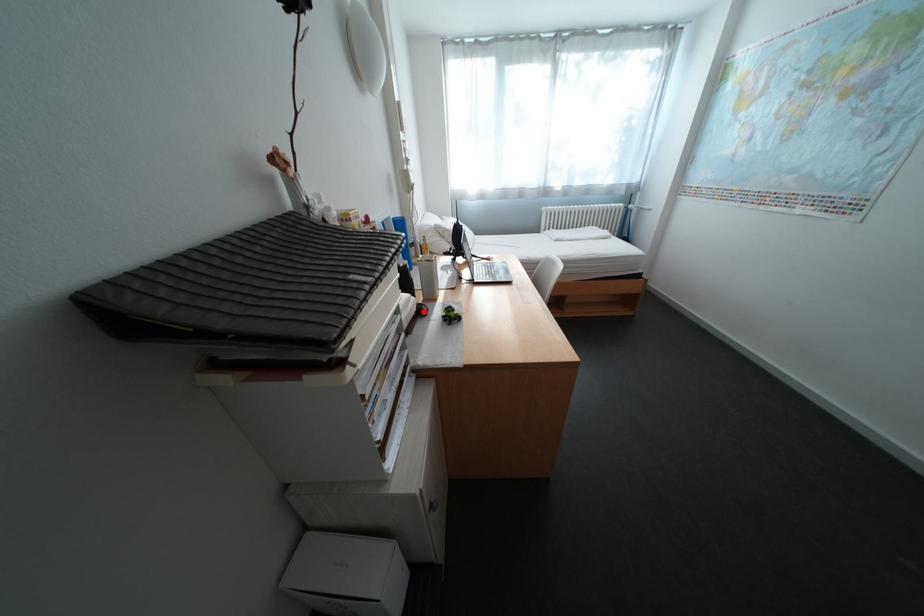
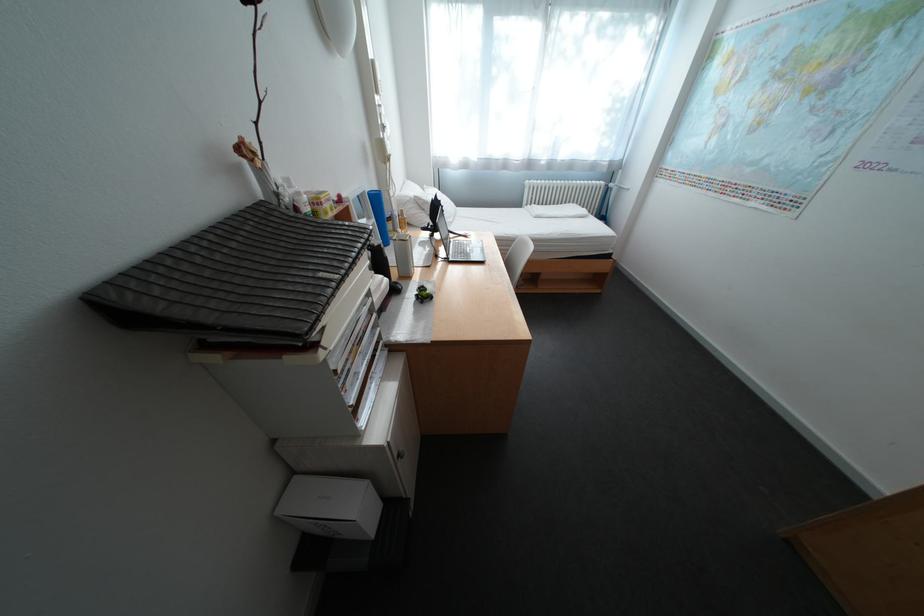
Locate, in the second image, the point that corresponds to the highlighted location in the first image.

(395, 292)